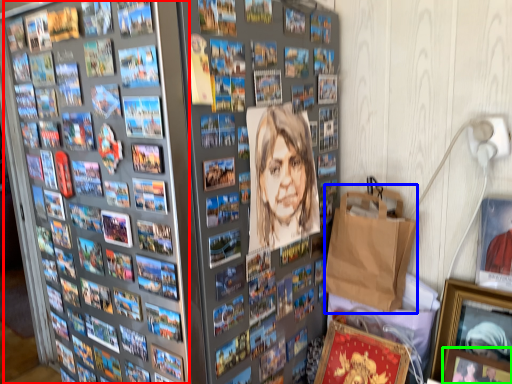
Question: Based on their relative distances, which object is nearer to comic book (highlighted by a red box)? Choose from paper bag (highlighted by a blue box) and picture frame (highlighted by a green box).

Choices:
 (A) paper bag
 (B) picture frame

Answer: (A)